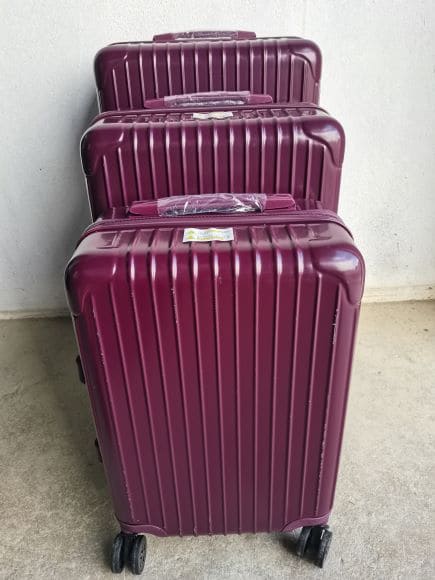
Find the location of a particular element. This screenshot has height=580, width=435. open tan rug space is located at coordinates (413, 521), (410, 379), (50, 392), (41, 484), (64, 536), (401, 540).